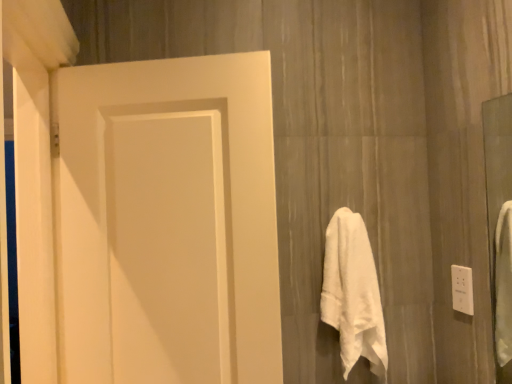
Question: Is white plastic outlet at right spatially inside white soft towel at center-right, or outside of it?

Choices:
 (A) inside
 (B) outside

Answer: (B)

Question: From the image's perspective, is white plastic outlet at right above or below white soft towel at center-right?

Choices:
 (A) below
 (B) above

Answer: (B)

Question: Which object is positioned farthest from the white plastic outlet at right?

Choices:
 (A) matte white door at left
 (B) white soft towel at center-right

Answer: (A)

Question: Which object is positioned farthest from the matte white door at left?

Choices:
 (A) white soft towel at center-right
 (B) white plastic outlet at right

Answer: (B)